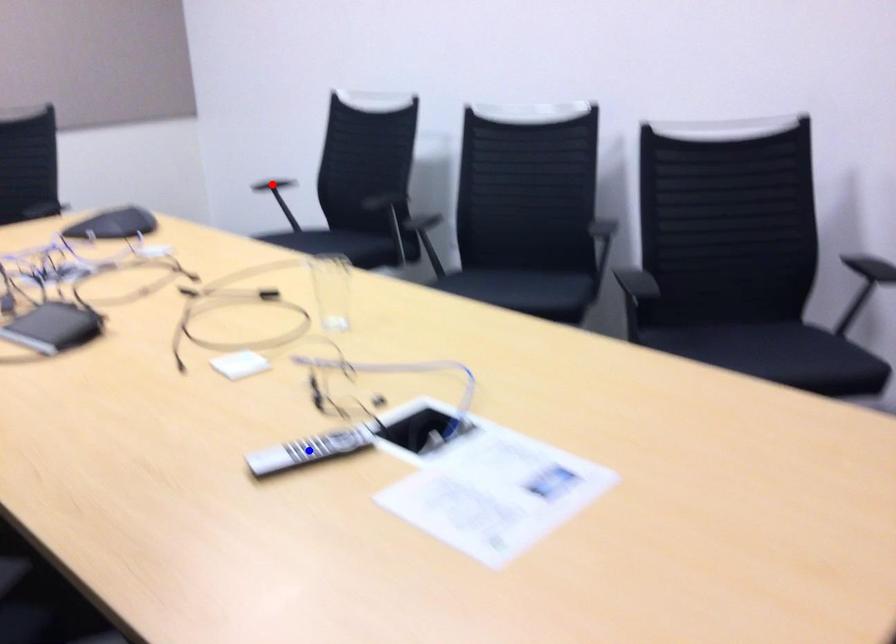
Question: Two points are marked on the image. Which point is closer to the camera?

Choices:
 (A) Blue point is closer.
 (B) Red point is closer.

Answer: (A)